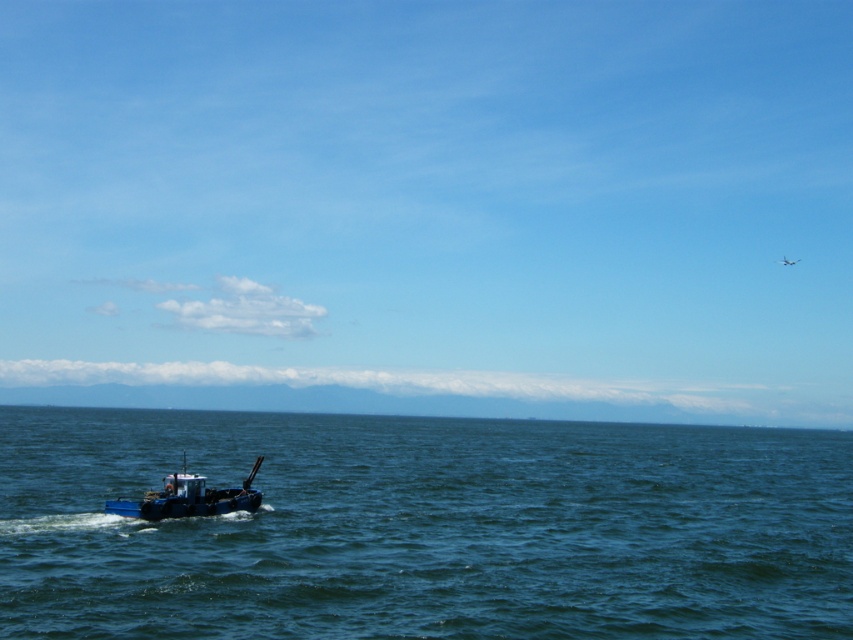
Between point (705, 477) and point (235, 508), which one is positioned in front?

Positioned in front is point (235, 508).

Measure the distance between point (303, 628) and camera.

Point (303, 628) and camera are 17.76 meters apart from each other.

Is point (740, 576) positioned after point (178, 509)?

No, it is not.

Find the location of `dark blue water at lower left`. dark blue water at lower left is located at coordinates (424, 528).